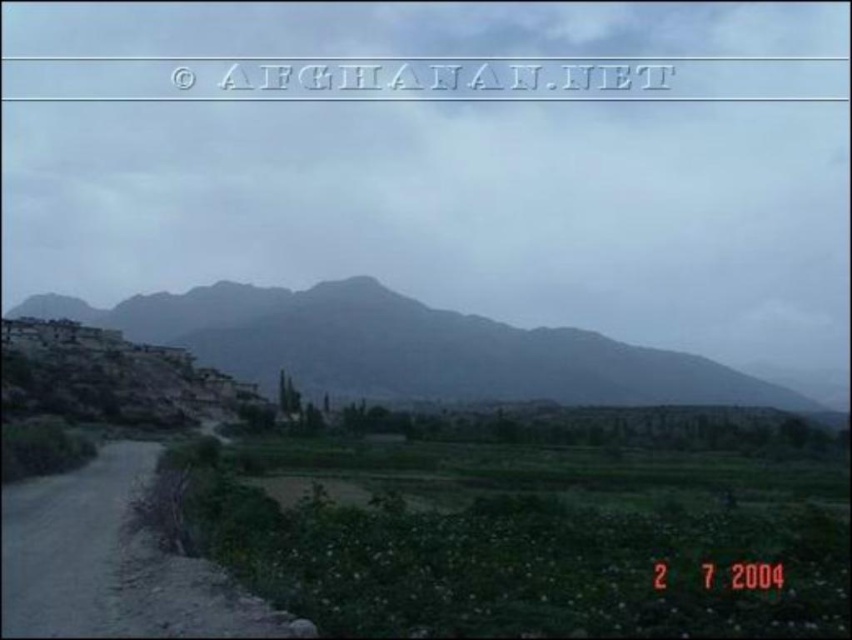
You are a hiker standing at the point closer to the camera. Which point are you at, point (717,376) or point (122,474)?

You are at point (717,376) because it is further to the camera than point (122,474).

Looking at this image, you are planning to cross the dark gray rock at center and the dirt road at lower left. Which one is wider? Please choose between the two.

The dark gray rock at center is wider than the dirt road at lower left according to the description.